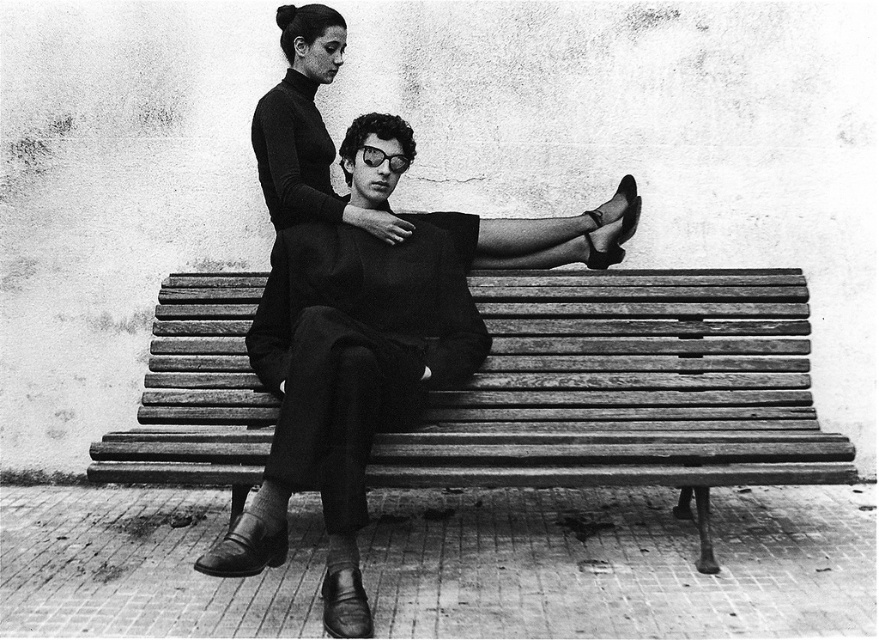
Question: Is wooden bench at center to the left of smooth leather jacket at center from the viewer's perspective?

Choices:
 (A) yes
 (B) no

Answer: (B)

Question: Where is wooden bench at center located in relation to smooth leather jacket at center in the image?

Choices:
 (A) below
 (B) above

Answer: (A)

Question: Which point appears farthest from the camera in this image?

Choices:
 (A) (245, 404)
 (B) (349, 481)

Answer: (A)

Question: Is wooden bench at center closer to camera compared to smooth leather jacket at center?

Choices:
 (A) yes
 (B) no

Answer: (B)